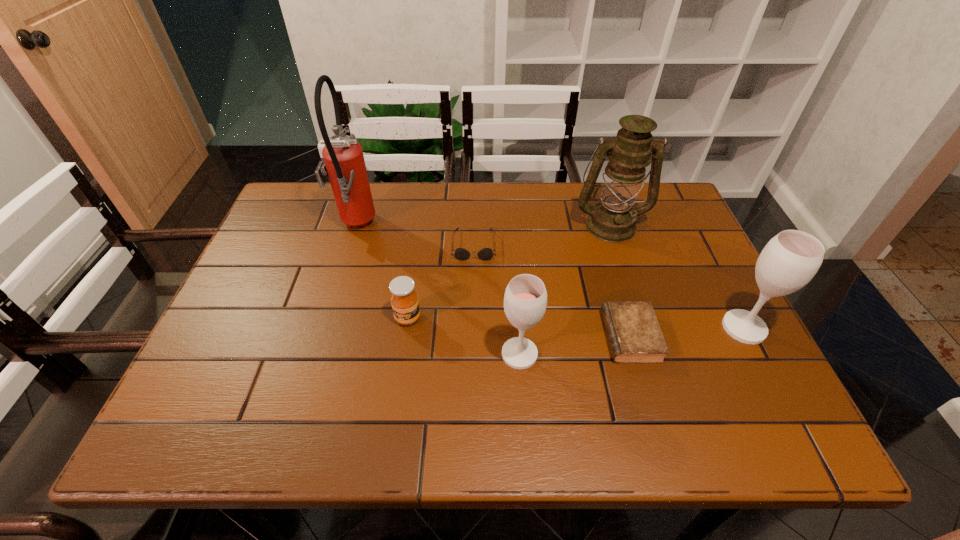
Please show where to add a wineglass on the left while keeping spacing even. Please provide its 2D coordinates. Your answer should be formatted as a tuple, i.e. [(x, y)], where the tuple contains the x and y coordinates of a point satisfying the conditions above.

[(271, 383)]